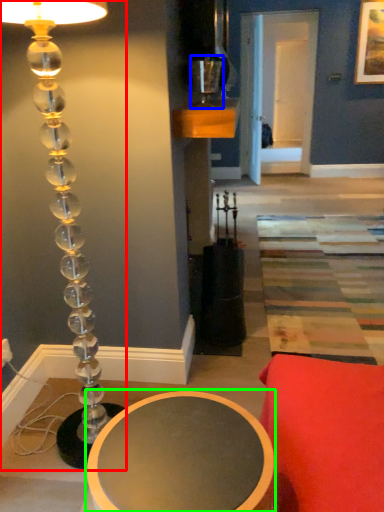
Question: Which is nearer to the lamp (highlighted by a red box)? candle holder (highlighted by a blue box) or table (highlighted by a green box).

Choices:
 (A) candle holder
 (B) table

Answer: (B)